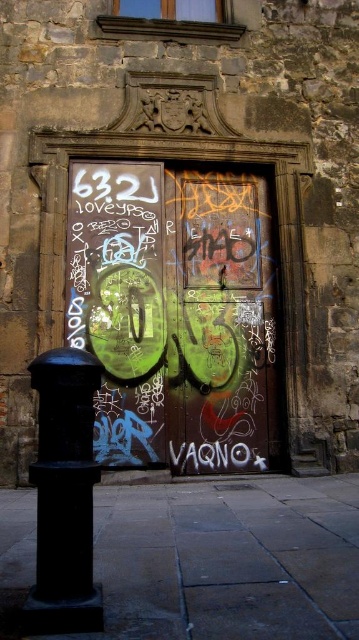
Does point (179, 225) come closer to viewer compared to point (82, 579)?

No, it is behind (82, 579).

Is green matte door at center smaller than black matte pole at lower left?

No, green matte door at center is not smaller than black matte pole at lower left.

This screenshot has height=640, width=359. What do you see at coordinates (175, 314) in the screenshot?
I see `green matte door at center` at bounding box center [175, 314].

The height and width of the screenshot is (640, 359). I want to click on green matte door at center, so click(175, 314).